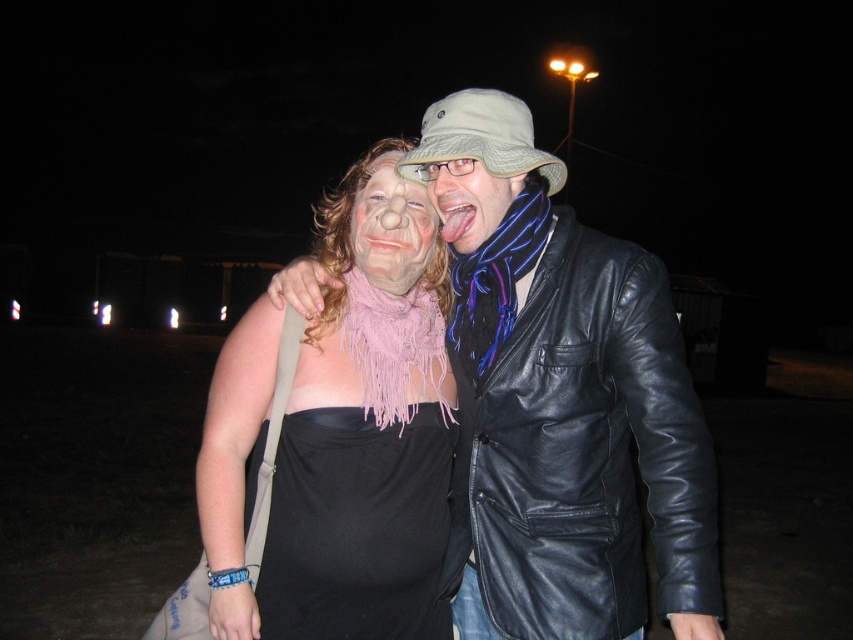
Can you confirm if black leather jacket at right is positioned below matte black jacket at center?

Correct, black leather jacket at right is located below matte black jacket at center.

Can you confirm if black leather jacket at right is positioned above matte black jacket at center?

Actually, black leather jacket at right is below matte black jacket at center.

Who is more forward, (647,499) or (502,209)?

Positioned in front is point (502,209).

I want to click on black leather jacket at right, so click(584, 451).

Can you confirm if pink fringed scarf at center is positioned below black matte dress at center?

Actually, pink fringed scarf at center is above black matte dress at center.

Is pink fringed scarf at center wider than black matte dress at center?

Correct, the width of pink fringed scarf at center exceeds that of black matte dress at center.

Which is in front, point (428, 374) or point (373, 570)?

Point (373, 570)

The height and width of the screenshot is (640, 853). I want to click on pink fringed scarf at center, so click(361, 440).

Which is below, tan fabric hat at center or pink fabric mask at center?

pink fabric mask at center is lower down.

Does tan fabric hat at center appear on the left side of pink fabric mask at center?

In fact, tan fabric hat at center is to the right of pink fabric mask at center.

The height and width of the screenshot is (640, 853). What are the coordinates of `tan fabric hat at center` in the screenshot? It's located at (480, 138).

Find the location of a particular element. This screenshot has height=640, width=853. tan fabric hat at center is located at coordinates (480, 138).